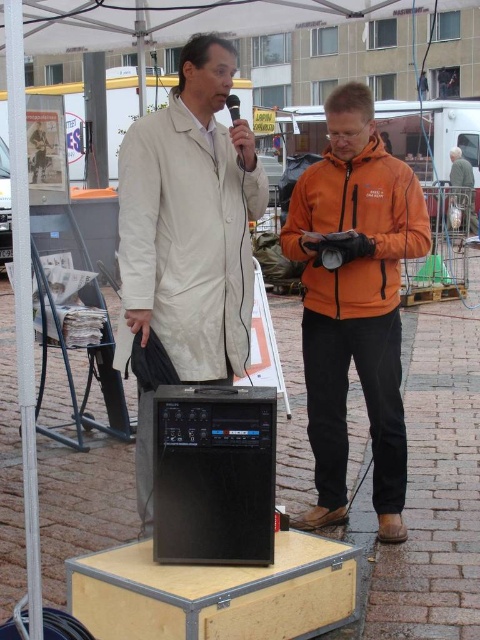
You are an event organizer who needs to place a 15 inch wide decorative plant pot between the matte white coat at center and the orange fleece jacket at center. Can you fit it without overlapping either garment?

The distance between the matte white coat at center and the orange fleece jacket at center is 23.04 inches. Since the plant pot is 15 inches wide, there is enough space to place it between them without overlapping either garment.

Based on the photo, you are standing at the entrance of the tent and need to locate the matte white coat at center. According to the coordinates provided, where should you look relative to the center of the image?

The matte white coat at center is located at coordinates point 0.348 on the x axis and 0.396 on the y axis, which is slightly to the left and above the center of the image.

Based on the photo, you are an event organizer standing behind the wooden platform. You need to hand a microphone to the speaker wearing the matte white coat at center and the orange fleece jacket at center. Which one is easier to reach without moving from your current position?

The matte white coat at center is closer to the viewer than the orange fleece jacket at center, so it is easier to reach without moving from your current position.